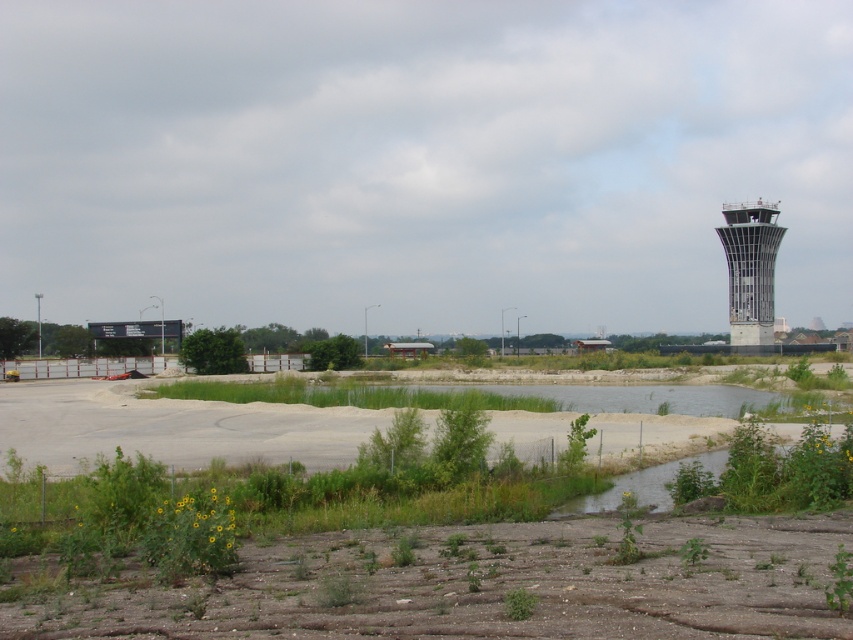
From the picture: You are standing at the edge of the dry ground in the foreground of the image. You see two points marked in the scene. Which point, point (221, 433) or point (733, 237), is closer to you?

Point (221, 433) is closer to the viewer than point (733, 237).

You are a surveyor evaluating the site for potential solar panel installation. The gray sandy dirt field at lower center and the metallic glass control tower at right are key features. Which of these two areas has a larger available space for placing solar panels?

The gray sandy dirt field at lower center is bigger than the metallic glass control tower at right, so the gray sandy dirt field at lower center has a larger available space for placing solar panels.

You are standing at the point marked as point (172, 426) in the image. What is the type of terrain you are currently standing on?

The terrain at point (172, 426) is a gray sandy dirt field at lower center.